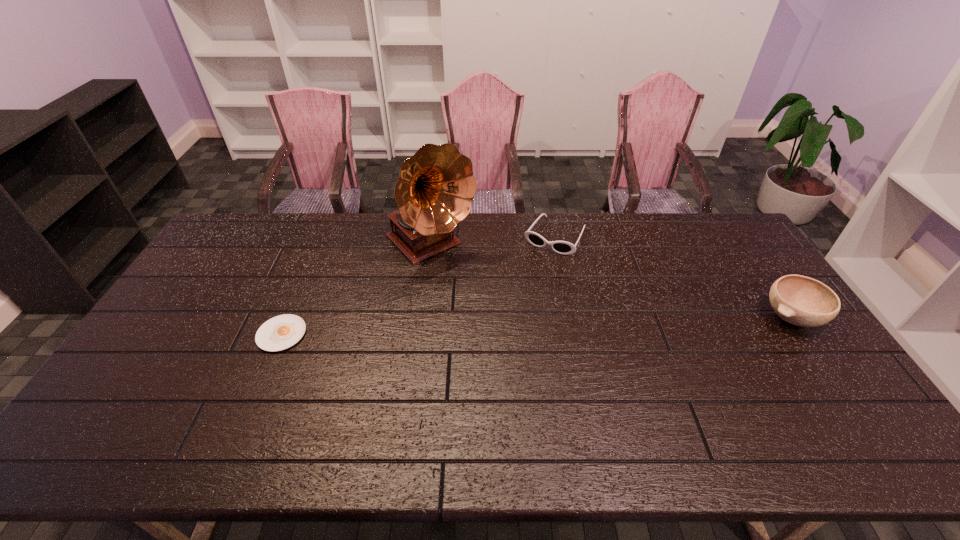
Identify the location of vacant space at the near edge of the desktop. The width and height of the screenshot is (960, 540). (237, 387).

In the image, there is a desktop. Where is `free region at the left edge`? This screenshot has width=960, height=540. free region at the left edge is located at coordinates (221, 267).

Find the location of `vacant area at the right edge of the desktop`. vacant area at the right edge of the desktop is located at coordinates (799, 369).

Locate an element on the screen. The image size is (960, 540). vacant space at the far left corner is located at coordinates click(x=253, y=214).

At what (x,y) coordinates should I click in order to perform the action: click on free region at the near left corner of the desktop. Please return your answer as a coordinate pair (x, y). The image size is (960, 540). Looking at the image, I should click on (154, 392).

In the image, there is a desktop. Identify the location of vacant space at the far right corner. (732, 240).

Where is `free space between the egg yolk and the tallest object`? free space between the egg yolk and the tallest object is located at coordinates (356, 289).

At what (x,y) coordinates should I click in order to perform the action: click on unoccupied position between the bowl and the leftmost object. Please return your answer as a coordinate pair (x, y). Looking at the image, I should click on (537, 326).

At what (x,y) coordinates should I click in order to perform the action: click on unoccupied position between the tallest object and the third object from left to right. Please return your answer as a coordinate pair (x, y). The width and height of the screenshot is (960, 540). Looking at the image, I should click on (492, 241).

Find the location of a particular element. This screenshot has width=960, height=540. free space between the bowl and the phonograph_record is located at coordinates (611, 281).